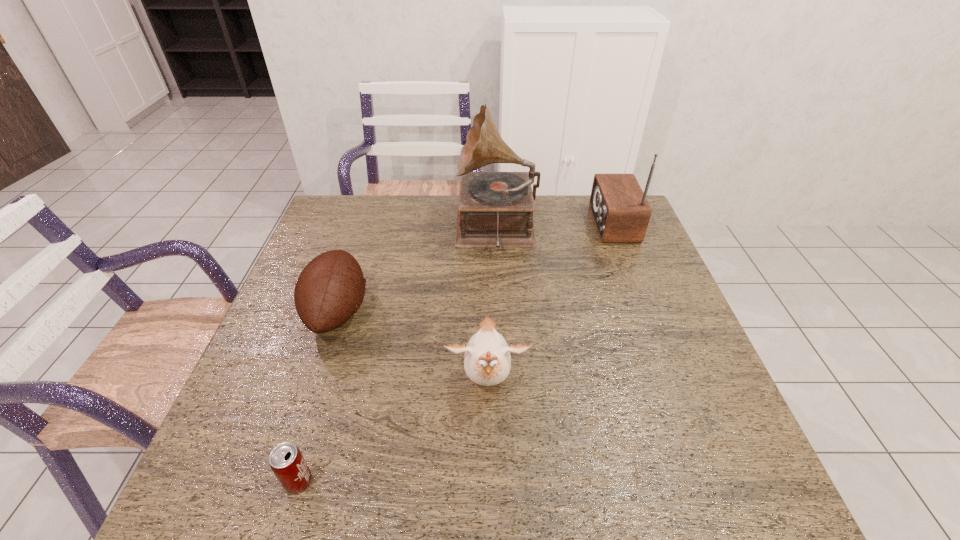
What are the coordinates of `beer can at the left edge` in the screenshot? It's located at (286, 461).

Where is `object that is at the right edge`? object that is at the right edge is located at coordinates (621, 212).

Locate an element on the screen. This screenshot has width=960, height=540. object that is at the near left corner is located at coordinates point(286,461).

You are a GUI agent. You are given a task and a screenshot of the screen. Output one action in this format:
    pyautogui.click(x=<x>, y=<y>)
    Task: Click on the object situated at the far right corner
    The width and height of the screenshot is (960, 540).
    Given the screenshot: What is the action you would take?
    pyautogui.click(x=621, y=212)

Identify the location of free space at the far edge. The width and height of the screenshot is (960, 540). (545, 233).

I want to click on vacant space at the right edge of the desktop, so click(x=649, y=294).

Locate an element on the screen. The image size is (960, 540). blank space at the far left corner of the desktop is located at coordinates (345, 212).

In the image, there is a desktop. Identify the location of free space at the near left corner. (262, 499).

In the image, there is a desktop. Where is `vacant region at the far right corner`? This screenshot has width=960, height=540. vacant region at the far right corner is located at coordinates (595, 227).

You are a GUI agent. You are given a task and a screenshot of the screen. Output one action in this format:
    pyautogui.click(x=<x>, y=<y>)
    Task: Click on the unoccupied area between the football and the shortest object
    The image size is (960, 540).
    Given the screenshot: What is the action you would take?
    pyautogui.click(x=318, y=396)